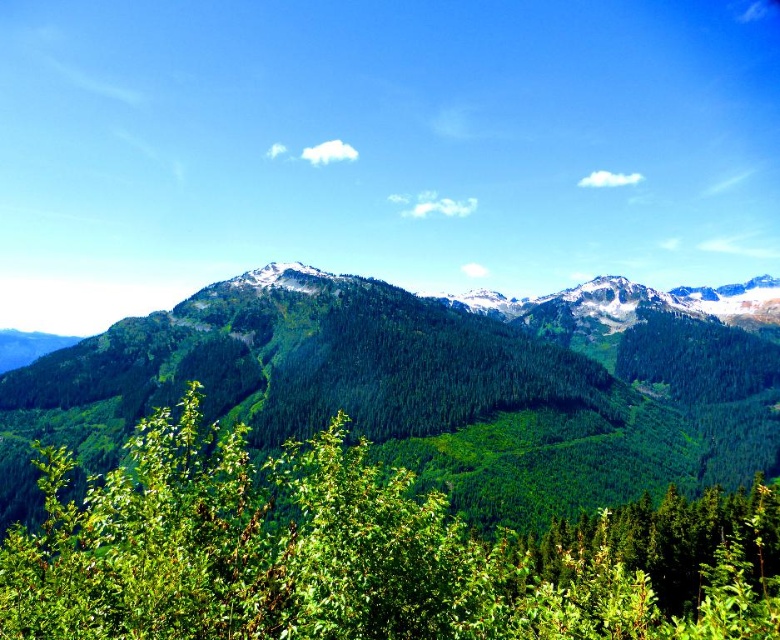
Question: Which of the following is the farthest from the observer?

Choices:
 (A) (62, 611)
 (B) (169, 339)

Answer: (B)

Question: Does green forested mountain range at center appear over green leafy tree at center?

Choices:
 (A) yes
 (B) no

Answer: (A)

Question: Is green forested mountain range at center wider than green leafy tree at center?

Choices:
 (A) no
 (B) yes

Answer: (B)

Question: Can you confirm if green forested mountain range at center is thinner than green leafy tree at center?

Choices:
 (A) yes
 (B) no

Answer: (B)

Question: Which object appears closest to the camera in this image?

Choices:
 (A) green leafy tree at center
 (B) green forested mountain range at center

Answer: (A)